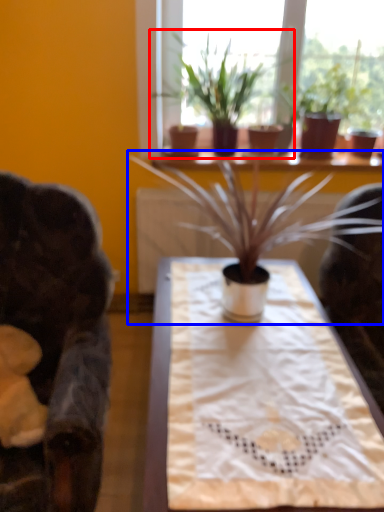
Question: Among these objects, which one is nearest to the camera, houseplant (highlighted by a red box) or houseplant (highlighted by a blue box)?

Choices:
 (A) houseplant
 (B) houseplant

Answer: (B)